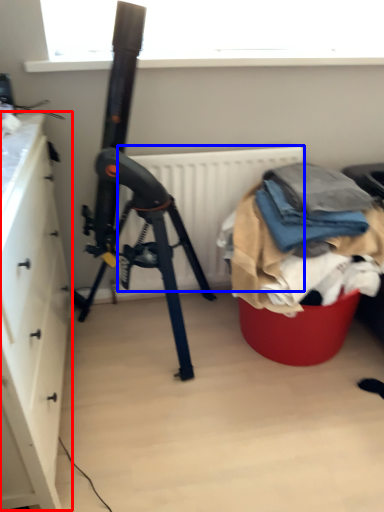
Question: Which point is closer to the camera, cabinetry (highlighted by a red box) or radiator (highlighted by a blue box)?

Choices:
 (A) cabinetry
 (B) radiator

Answer: (A)